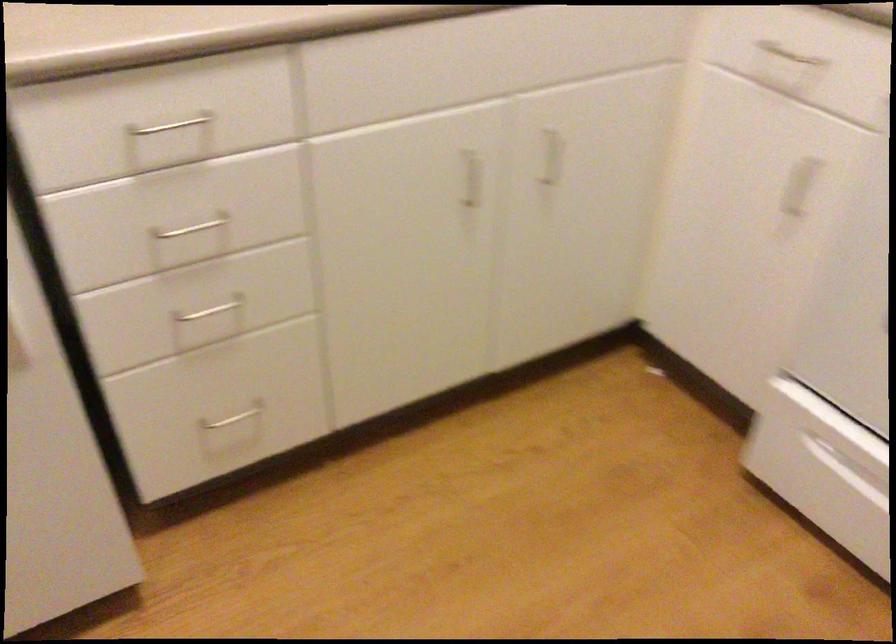
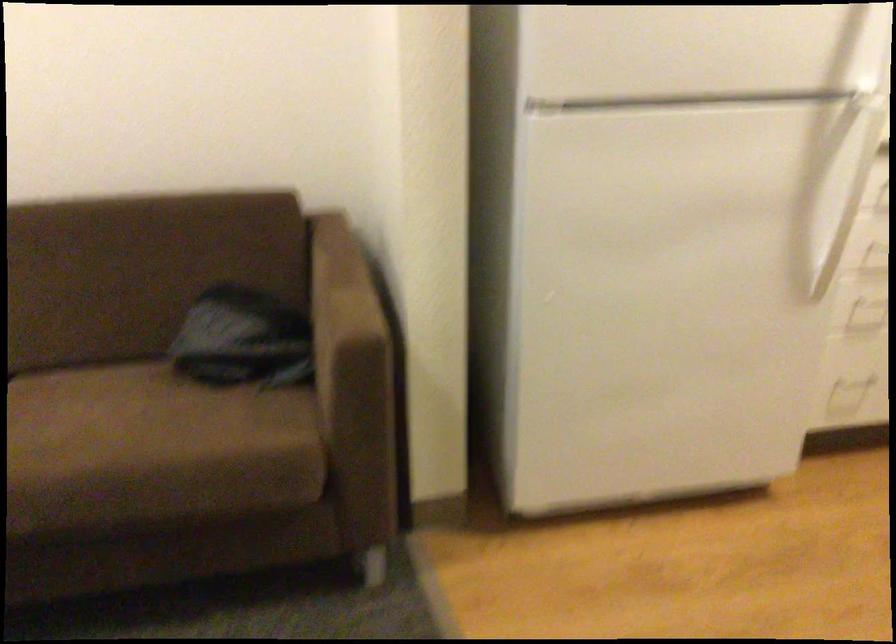
The images are taken continuously from a first-person perspective. In which direction are you moving?

The cameraman moved toward left, backward.